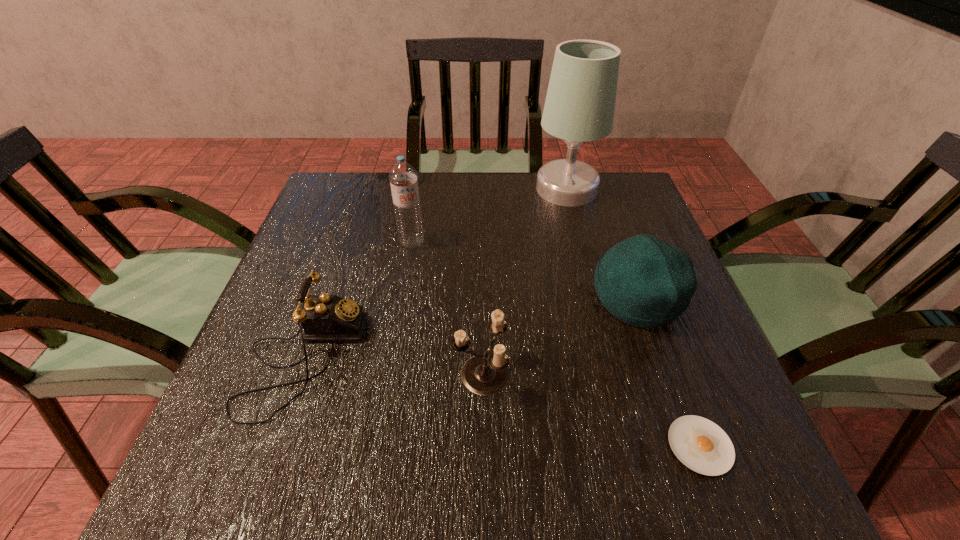
Where is `free spot located on the base of the lampshade`? free spot located on the base of the lampshade is located at coordinates (446, 189).

What are the coordinates of `vacant space located 0.150m on the front of the fifth shortest object` in the screenshot? It's located at (402, 295).

This screenshot has height=540, width=960. What are the coordinates of `blank space located on the back of the beanie` in the screenshot? It's located at (621, 249).

Find the location of a particular element. Image resolution: width=960 pixels, height=540 pixels. vacant position located 0.210m on the back of the candle holder is located at coordinates (481, 275).

Where is `vacant space located 0.210m on the dial of the leftmost object`? This screenshot has width=960, height=540. vacant space located 0.210m on the dial of the leftmost object is located at coordinates (469, 359).

You are a GUI agent. You are given a task and a screenshot of the screen. Output one action in this format:
    pyautogui.click(x=<x>, y=<y>)
    Task: Click on the vacant space located 0.080m on the left of the shortest object
    
    Given the screenshot: What is the action you would take?
    pyautogui.click(x=619, y=446)

This screenshot has height=540, width=960. Find the location of `object located at the far edge`. object located at the far edge is located at coordinates (580, 103).

Identify the location of object that is at the near edge. The width and height of the screenshot is (960, 540). (700, 444).

I want to click on object that is at the left edge, so click(x=324, y=317).

You are a GUI agent. You are given a task and a screenshot of the screen. Output one action in this format:
    pyautogui.click(x=<x>, y=<y>)
    Task: Click on the lampshade at the right edge
    Image resolution: width=960 pixels, height=540 pixels.
    Given the screenshot: What is the action you would take?
    pyautogui.click(x=580, y=103)